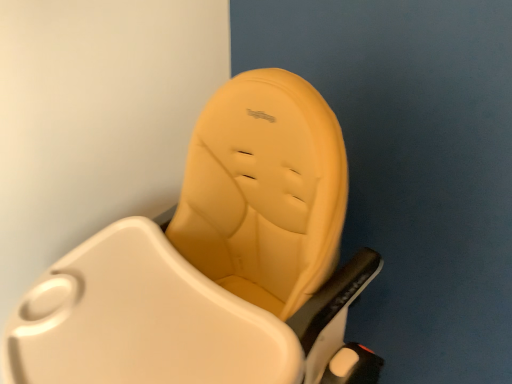
At what (x,y) coordinates should I click in order to perform the action: click on matte yellow plastic high chair at center. Please return your answer as a coordinate pair (x, y). The image size is (512, 384). Looking at the image, I should click on (215, 263).

What do you see at coordinates (215, 263) in the screenshot?
I see `matte yellow plastic high chair at center` at bounding box center [215, 263].

Locate an element on the screen. matte yellow plastic high chair at center is located at coordinates (215, 263).